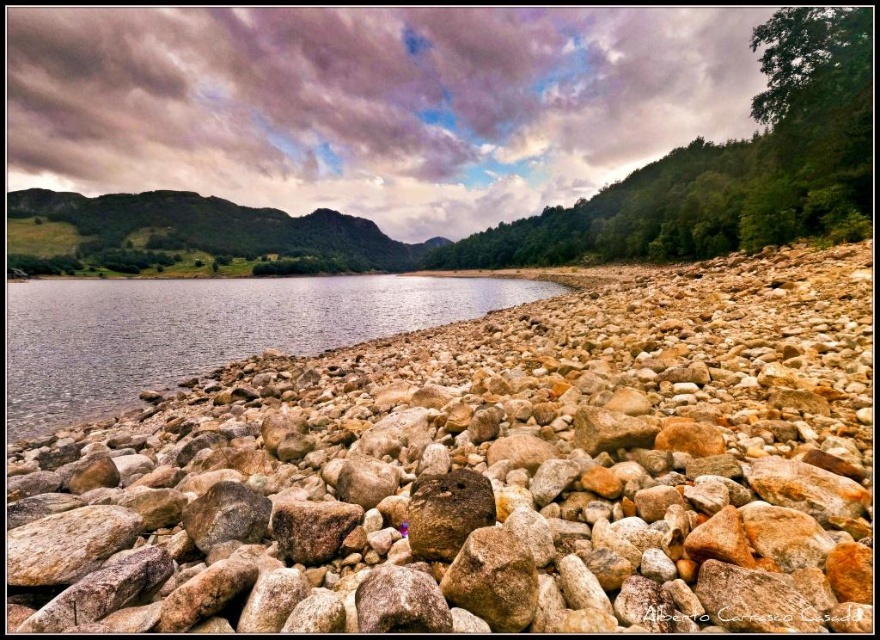
Is brown rocky shoreline at lower left positioned at the back of clear water at shore left?

No, it is not.

Can you confirm if brown rocky shoreline at lower left is bigger than clear water at shore left?

Actually, brown rocky shoreline at lower left might be smaller than clear water at shore left.

Who is more distant from viewer, (195,410) or (320,321)?

Positioned behind is point (320,321).

Where is `brown rocky shoreline at lower left`? This screenshot has height=640, width=880. brown rocky shoreline at lower left is located at coordinates (490, 474).

Is clear water at shore left bigger than brown rough rock at center?

Indeed, clear water at shore left has a larger size compared to brown rough rock at center.

Is point (462, 284) farther from viewer compared to point (462, 468)?

Yes.

Which is in front, point (319, 326) or point (471, 472)?

Positioned in front is point (471, 472).

What are the coordinates of `clear water at shore left` in the screenshot? It's located at (204, 330).

Which is above, brown rocky shoreline at lower left or brown rough rock at center?

brown rocky shoreline at lower left is above.

Is brown rocky shoreline at lower left below brown rough rock at center?

No, brown rocky shoreline at lower left is not below brown rough rock at center.

The image size is (880, 640). I want to click on brown rocky shoreline at lower left, so click(x=490, y=474).